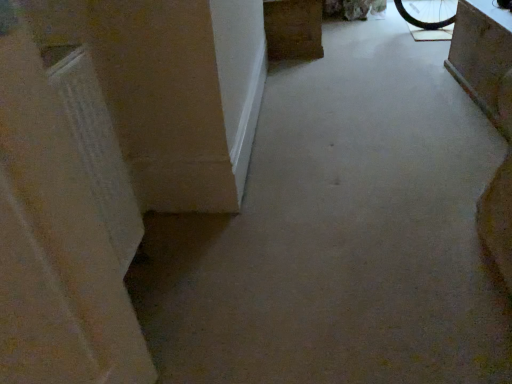
Question: Is brown wood cabinet at upper center, acting as the 1th furniture starting from the top, to the left or to the right of concrete block at upper right, the 2th furniture in the top-to-bottom sequence, in the image?

Choices:
 (A) right
 (B) left

Answer: (B)

Question: Considering their positions, is brown wood cabinet at upper center, acting as the second furniture starting from the right, located in front of or behind concrete block at upper right, which ranks as the first furniture in front-to-back order?

Choices:
 (A) front
 (B) behind

Answer: (B)

Question: From the image's perspective, relative to concrete block at upper right, the 1th furniture positioned from the right, is brown wood cabinet at upper center, the 1th furniture in the left-to-right sequence, above or below?

Choices:
 (A) above
 (B) below

Answer: (A)

Question: In terms of size, does concrete block at upper right, acting as the 2th furniture starting from the left, appear bigger or smaller than brown wood cabinet at upper center, which is the second furniture in front-to-back order?

Choices:
 (A) small
 (B) big

Answer: (A)

Question: Considering the relative positions of concrete block at upper right, acting as the 2th furniture starting from the left, and brown wood cabinet at upper center, which is the second furniture in front-to-back order, in the image provided, is concrete block at upper right, acting as the 2th furniture starting from the left, to the left or to the right of brown wood cabinet at upper center, which is the second furniture in front-to-back order,?

Choices:
 (A) left
 (B) right

Answer: (B)

Question: Does point (470, 34) appear closer or farther from the camera than point (287, 6)?

Choices:
 (A) farther
 (B) closer

Answer: (B)

Question: In the image, is concrete block at upper right, acting as the 2th furniture starting from the left, positioned in front of or behind brown wood cabinet at upper center, which is counted as the 2th furniture, starting from the bottom?

Choices:
 (A) front
 (B) behind

Answer: (A)